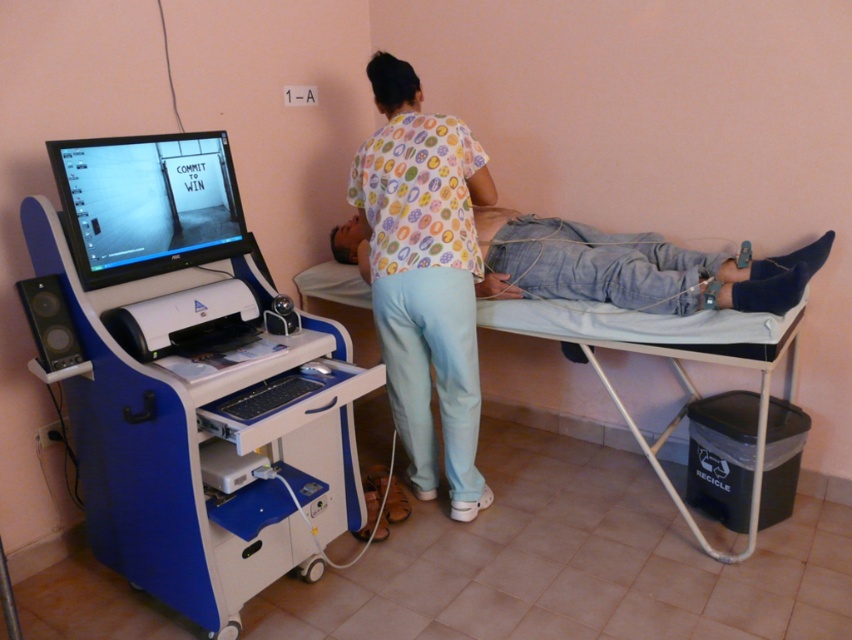
Can you confirm if printed fabric shirt at center is taller than jeans at center?

Yes, printed fabric shirt at center is taller than jeans at center.

Describe the element at coordinates (424, 275) in the screenshot. I see `printed fabric shirt at center` at that location.

Which is behind, point (415, 305) or point (790, 276)?

The point (415, 305) is more distant.

At what (x,y) coordinates should I click in order to perform the action: click on printed fabric shirt at center. Please return your answer as a coordinate pair (x, y). This screenshot has width=852, height=640. Looking at the image, I should click on (424, 275).

Is point (104, 269) behind point (764, 340)?

No, it is not.

Is the position of black glossy monitor at left more distant than that of blue fabric bed at center?

No.

What do you see at coordinates (147, 204) in the screenshot? I see `black glossy monitor at left` at bounding box center [147, 204].

In order to click on black glossy monitor at left in this screenshot , I will do `click(147, 204)`.

Does blue plastic cart at left appear over jeans at center?

Incorrect, blue plastic cart at left is not positioned above jeans at center.

Is blue plastic cart at left below jeans at center?

Indeed, blue plastic cart at left is positioned under jeans at center.

What do you see at coordinates (204, 433) in the screenshot?
I see `blue plastic cart at left` at bounding box center [204, 433].

Where is `blue plastic cart at left`? blue plastic cart at left is located at coordinates (204, 433).